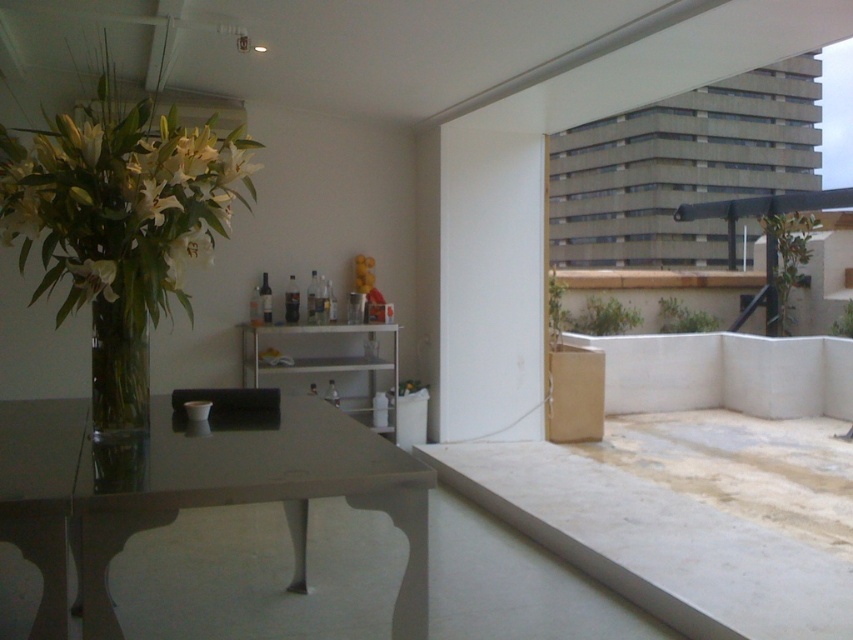
You are arranging flowers for an event and need to place a bouquet in the leftmost vase. Which vase should you choose between the clear glass vase at left and the translucent glass vase at left?

The clear glass vase at left is to the left of the translucent glass vase at left, so you should choose the clear glass vase at left as it is the leftmost one.

You are a guest at a dinner party and want to place your coat on the glossy glass table at center without knocking over the clear glass vase at left. Is the table tall enough to avoid the vase being hit?

The glossy glass table at center is taller than the clear glass vase at left, so placing your coat on the table should not knock over the vase as the table is higher.

You are arranging flowers for a dinner party and need to place the translucent glass vase at left on the glossy glass table at center. Can you place it directly above the table?

The glossy glass table at center is below the translucent glass vase at left, so yes, you can place the translucent glass vase at left directly above the table since it is already positioned there.